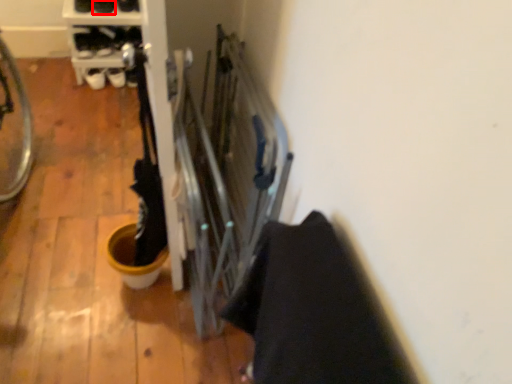
Question: From the image's perspective, where is footwear (annotated by the red box) located relative to footwear?

Choices:
 (A) above
 (B) below

Answer: (B)